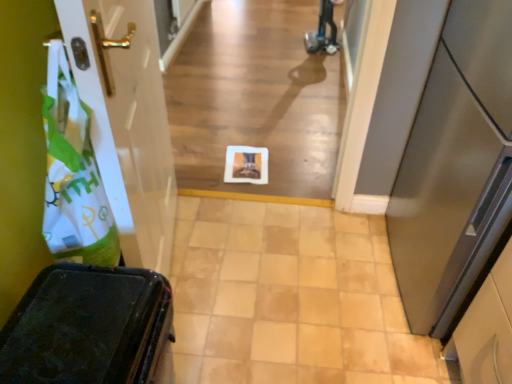
This screenshot has height=384, width=512. I want to click on vacant space underneath white glossy door at left, placed as the 2th door when sorted from right to left (from a real-world perspective), so click(179, 261).